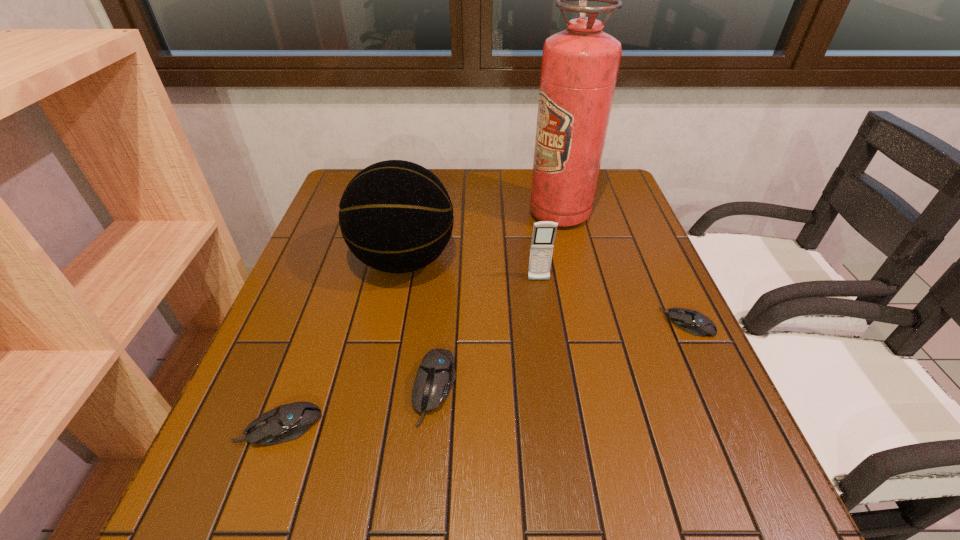
Where is `free space between the leftmost computer mouse and the second computer mouse from left to right`? free space between the leftmost computer mouse and the second computer mouse from left to right is located at coordinates (357, 408).

The width and height of the screenshot is (960, 540). In order to click on free area in between the tallest object and the leftmost computer mouse in this screenshot , I will do `click(420, 320)`.

Image resolution: width=960 pixels, height=540 pixels. In order to click on vacant area that lies between the fire extinguisher and the fifth shortest object in this screenshot , I will do `click(482, 237)`.

Find the location of `free space that is in between the second computer mouse from left to right and the shortest computer mouse`. free space that is in between the second computer mouse from left to right and the shortest computer mouse is located at coordinates (562, 355).

Where is `vacant area that lies between the tallest object and the second shortest object`? The width and height of the screenshot is (960, 540). vacant area that lies between the tallest object and the second shortest object is located at coordinates (420, 320).

Image resolution: width=960 pixels, height=540 pixels. What are the coordinates of `empty space that is in between the tallest object and the fourth farthest object` in the screenshot? It's located at (623, 268).

Where is `vacant space that is in between the second tallest computer mouse and the basketball`? This screenshot has height=540, width=960. vacant space that is in between the second tallest computer mouse and the basketball is located at coordinates (342, 344).

Image resolution: width=960 pixels, height=540 pixels. I want to click on empty space between the second computer mouse from left to right and the second tallest computer mouse, so click(357, 408).

Point out which object is positioned as the fifth nearest to the second tallest object. Please provide its 2D coordinates. Your answer should be formatted as a tuple, i.e. [(x, y)], where the tuple contains the x and y coordinates of a point satisfying the conditions above.

[(691, 321)]

Where is `object identified as the closest to the third tallest object`? object identified as the closest to the third tallest object is located at coordinates (396, 216).